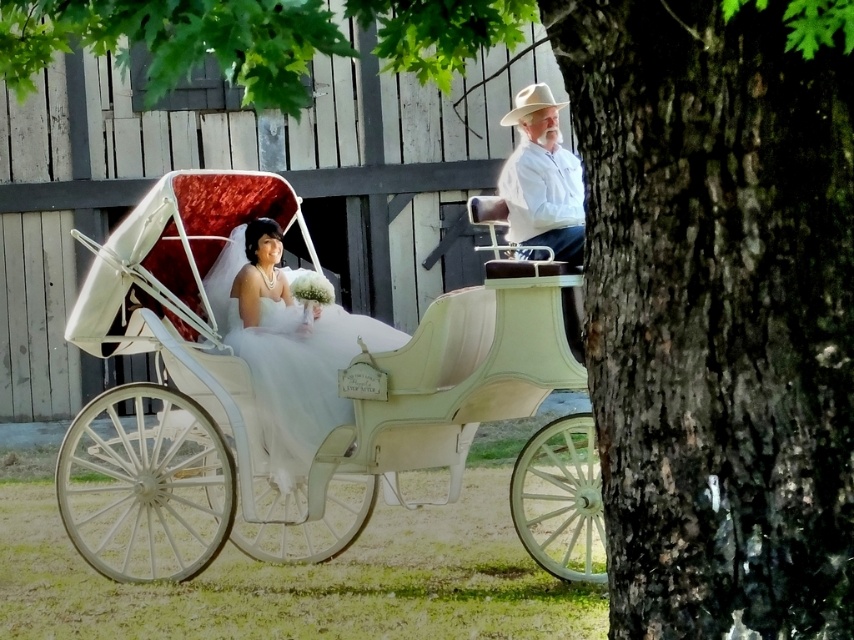
You are a photographer standing at the front of the white horse drawn carriage. You want to take a photo of the dark brown bark at right and the white matte hat at upper right so that both are in frame. Given that your camera has a maximum focus range of 15 feet, will you be able to capture both objects in focus at the same time?

The distance between the dark brown bark at right and the white matte hat at upper right is 18.05 feet. Since the camera can only focus within 15 feet, the objects are too far apart to be in focus simultaneously. Adjust your position or use a different camera setting to ensure both are in focus.

You are a photographer planning to take a photo of the dark brown bark at right and the white satin dress at center in the scene. Which object should you focus on first if you want to capture both in a single frame without moving the camera?

The dark brown bark at right is smaller than the white satin dress at center, so you should focus on the larger object first to ensure both fit well in the frame.

You are a photographer standing near the carriage and want to take a photo of the white matte hat at upper right without the dark brown bark at right blocking it. What should you do?

Move to the left side of the carriage so that the dark brown bark at right is no longer in front of the white matte hat at upper right.